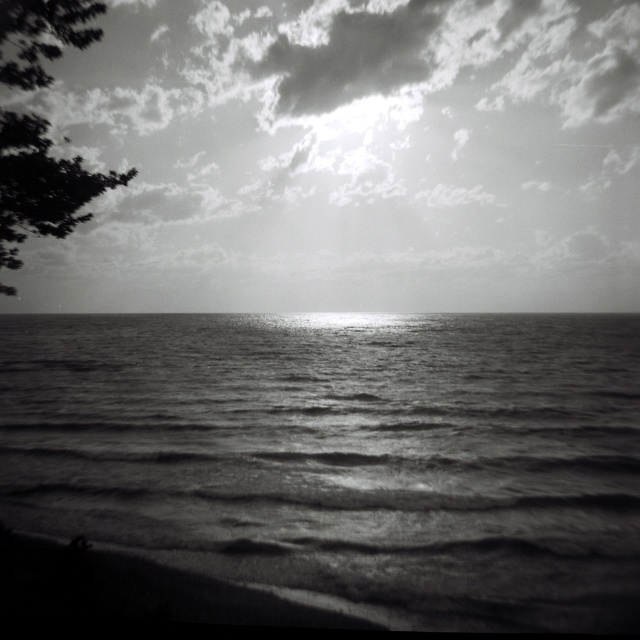
Is cloudy sky at upper center thinner than smooth water at center?

No, cloudy sky at upper center is not thinner than smooth water at center.

Describe the element at coordinates (349, 157) in the screenshot. This screenshot has width=640, height=640. I see `cloudy sky at upper center` at that location.

Identify the location of cloudy sky at upper center. (349, 157).

Is point (204, 257) positioned before point (10, 81)?

No, it is behind (10, 81).

Where is `cloudy sky at upper center`? cloudy sky at upper center is located at coordinates (349, 157).

Who is positioned more to the left, smooth water at center or dark green leafy tree at upper left?

dark green leafy tree at upper left is more to the left.

How much distance is there between smooth water at center and dark green leafy tree at upper left?

A distance of 44.17 meters exists between smooth water at center and dark green leafy tree at upper left.

Does point (225, 401) come farther from viewer compared to point (52, 36)?

Yes, it is behind point (52, 36).

You are a GUI agent. You are given a task and a screenshot of the screen. Output one action in this format:
    pyautogui.click(x=<x>, y=<y>)
    Task: Click on the smooth water at center
    This screenshot has height=640, width=640.
    Given the screenshot: What is the action you would take?
    pyautogui.click(x=342, y=456)